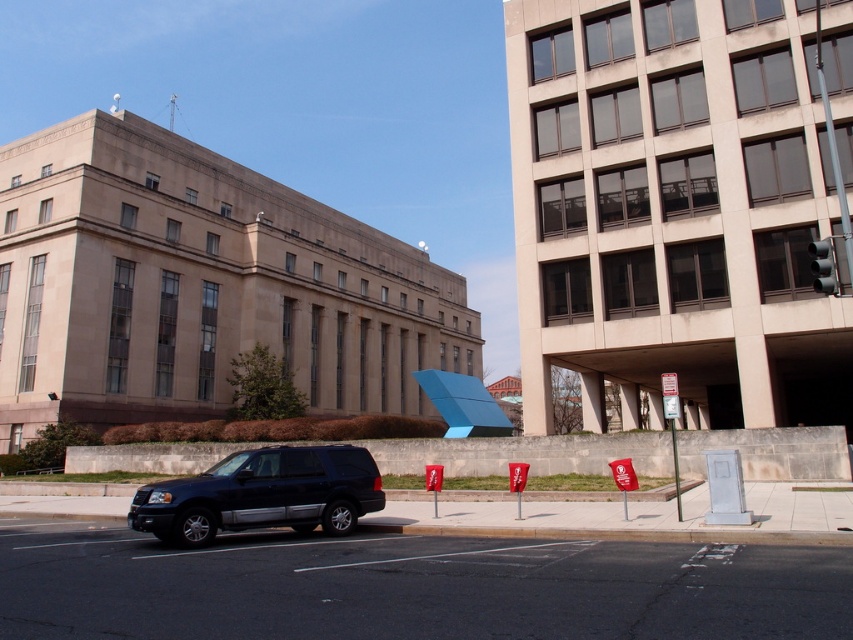
What do you see at coordinates (262, 493) in the screenshot? I see `shiny black suv at center` at bounding box center [262, 493].

Is shiny black suv at center positioned before metallic silver parking sign at right?

No, it is behind metallic silver parking sign at right.

Is point (329, 500) positioned after point (671, 401)?

No.

This screenshot has width=853, height=640. I want to click on shiny black suv at center, so coord(262,493).